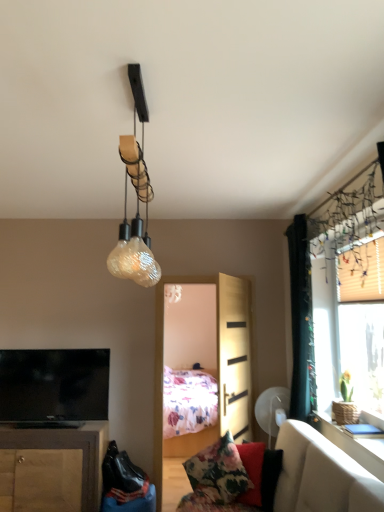
Question: Is point (301, 464) closer or farther from the camera than point (329, 430)?

Choices:
 (A) closer
 (B) farther

Answer: (A)

Question: Choose the correct answer: Is velvet beige couch at lower right inside white glossy table at upper right or outside it?

Choices:
 (A) outside
 (B) inside

Answer: (A)

Question: Which object is the farthest from the wooden cabinet at lower left?

Choices:
 (A) white glossy table at upper right
 (B) white textured blinds at upper right
 (C) black fabric curtain at right
 (D) flat screen tv at lower left
 (E) light wood screen door at center

Answer: (B)

Question: Estimate the real-world distances between objects in this image. Which object is closer to the floral fabric pillow at lower center?

Choices:
 (A) white textured blinds at upper right
 (B) light wood screen door at center
 (C) flat screen tv at lower left
 (D) black fabric curtain at right
 (E) white glossy table at upper right

Answer: (B)